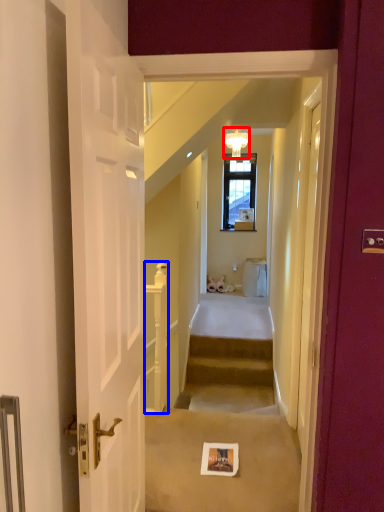
Question: Which object is further to the camera taking this photo, light fixture (highlighted by a red box) or balustrade (highlighted by a blue box)?

Choices:
 (A) light fixture
 (B) balustrade

Answer: (A)